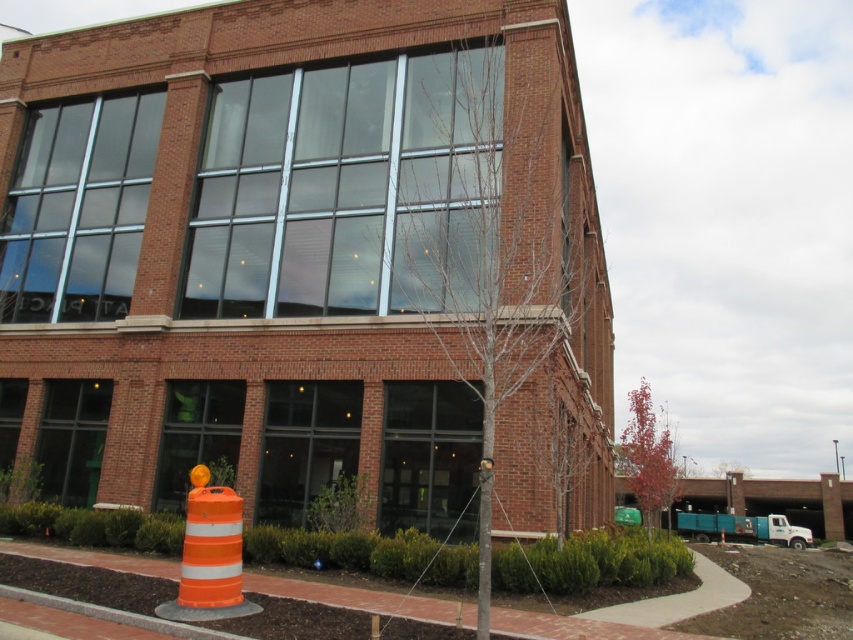
Question: Among these points, which one is nearest to the camera?

Choices:
 (A) (721, 529)
 (B) (218, 492)

Answer: (B)

Question: Is orange reflective cone at lower left thinner than orange reflective cone at center?

Choices:
 (A) yes
 (B) no

Answer: (A)

Question: Does orange reflective cone at lower left appear under orange reflective cone at center?

Choices:
 (A) yes
 (B) no

Answer: (B)

Question: Is orange reflective cone at lower left below orange reflective cone at center?

Choices:
 (A) yes
 (B) no

Answer: (B)